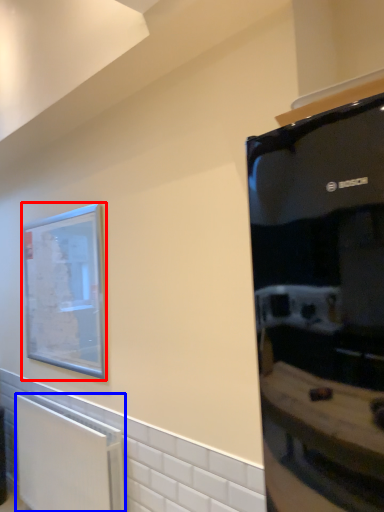
Question: Which object is further to the camera taking this photo, picture frame (highlighted by a red box) or radiator (highlighted by a blue box)?

Choices:
 (A) picture frame
 (B) radiator

Answer: (A)